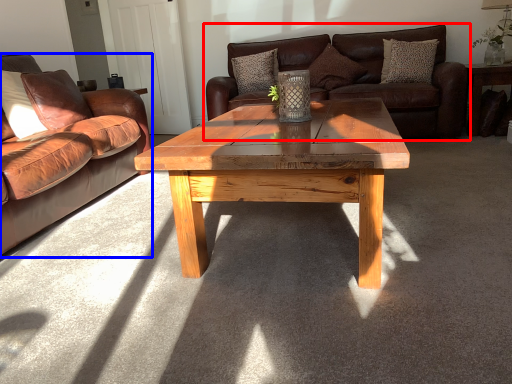
Question: Which point is further to the camera, studio couch (highlighted by a red box) or studio couch (highlighted by a blue box)?

Choices:
 (A) studio couch
 (B) studio couch

Answer: (A)